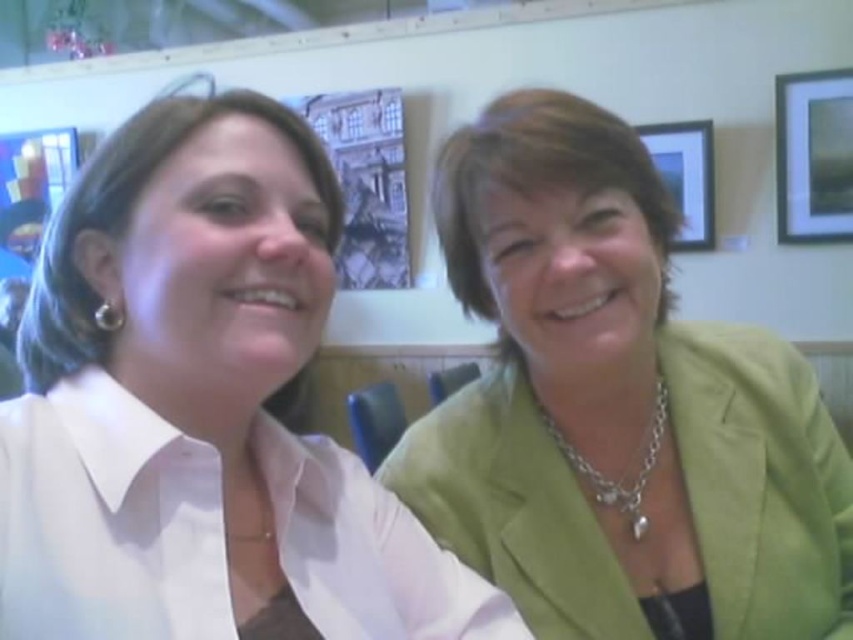
You are an interior designer assessing the wall decorations in the image. You see the matte black picture frame at upper right and the wooden picture frame at upper right. Which one is positioned more to the right?

The matte black picture frame at upper right is positioned more to the right than the wooden picture frame at upper right.

You are a photographer standing 24 inches away from the camera. You want to take a photo of the green fabric jacket at right. Can you reach it without moving your position?

The green fabric jacket at right is 21.15 inches away from the camera. Since you are standing 24 inches away from the camera, you are 2.85 inches behind the jacket. Therefore, you can reach it by extending your arm forward without moving your position.

You are a photographer standing in the room. You want to take a photo that includes both the matte white blouse at left and the matte black picture frame at upper right. Considering their distance, will you need to adjust your camera to focus on both subjects simultaneously?

The matte white blouse at left is 2.87 meters away from the matte black picture frame at upper right. Since they are at different distances, you may need to adjust your camera settings to ensure both are in focus, possibly using a smaller aperture for a deeper depth of field.